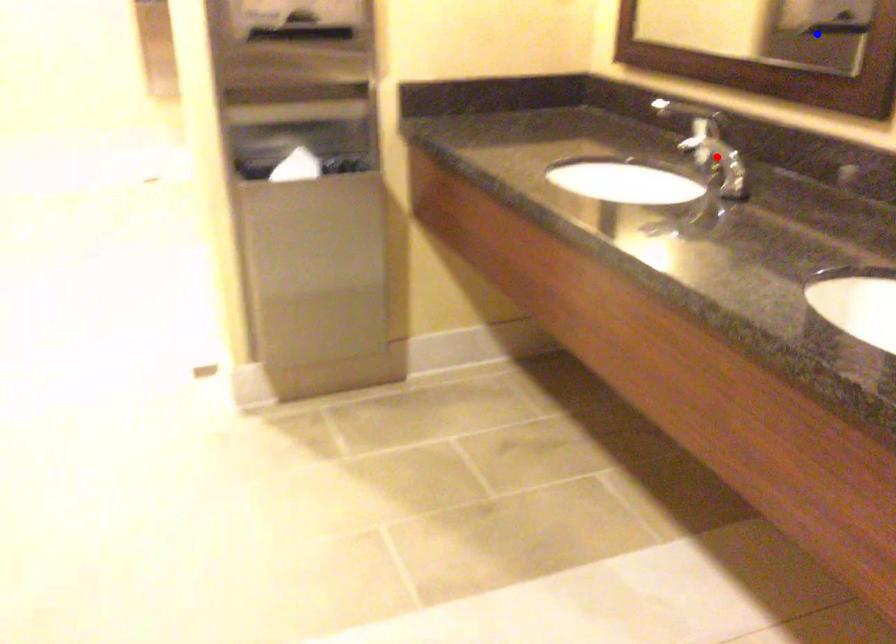
Question: Which of the two points in the image is closer to the camera?

Choices:
 (A) Blue point is closer.
 (B) Red point is closer.

Answer: (B)